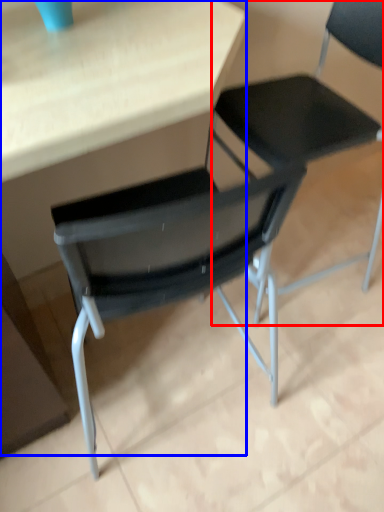
Question: Which of the following is the closest to the observer, chair (highlighted by a red box) or table (highlighted by a blue box)?

Choices:
 (A) chair
 (B) table

Answer: (B)